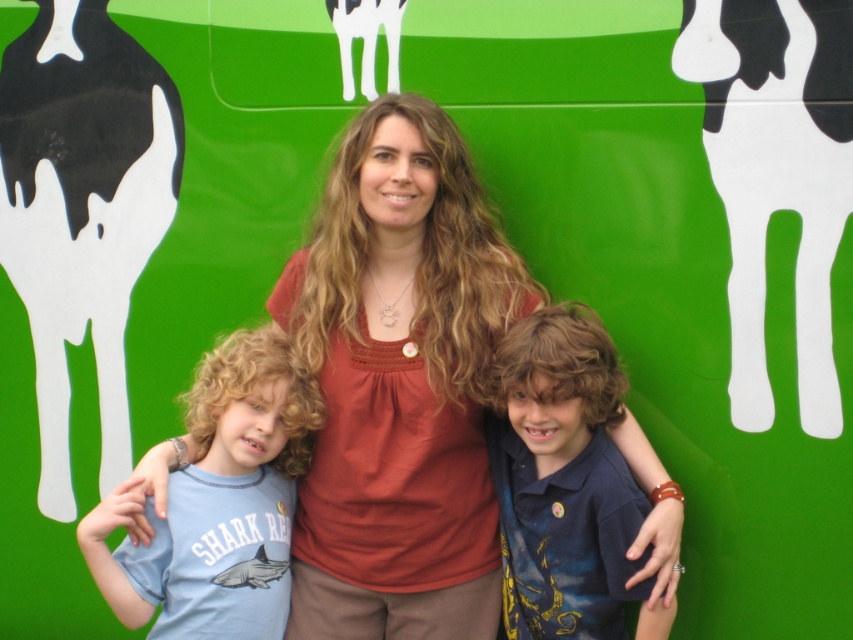
You are an artist who wants to paint a cow scene similar to the background design. You have two cows to place in your painting. The black glossy cow at left and the white matte cow at upper center. Which cow should you place on the left side of the other?

The black glossy cow at left should be placed on the left side of the white matte cow at upper center because the black glossy cow at left is positioned on the left side of white matte cow at upper center.

You are taking a photo of the scene and want to focus on the two points labeled as point (367,456) and point (126,154). Which point should you adjust your camera focus to first to ensure both are in focus?

You should focus on point (126,154) first because it is farther from the camera compared to point (367,456). This way, the depth of field will cover both points effectively.

You are an artist who needs to paint a line between the matte brown blouse at center and the black glossy cow at left. The paint you have can only cover 25 inches. Will you need more paint?

The distance between the matte brown blouse at center and the black glossy cow at left is 28.98 inches, which is longer than the 25 inches your paint can cover. Therefore, you will need more paint to complete the line.